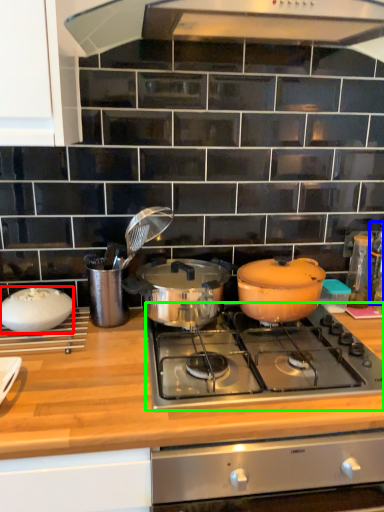
Question: Estimate the real-world distances between objects in this image. Which object is closer to kitchen appliance (highlighted by a red box), bottle (highlighted by a blue box) or gas stove (highlighted by a green box)?

Choices:
 (A) bottle
 (B) gas stove

Answer: (B)